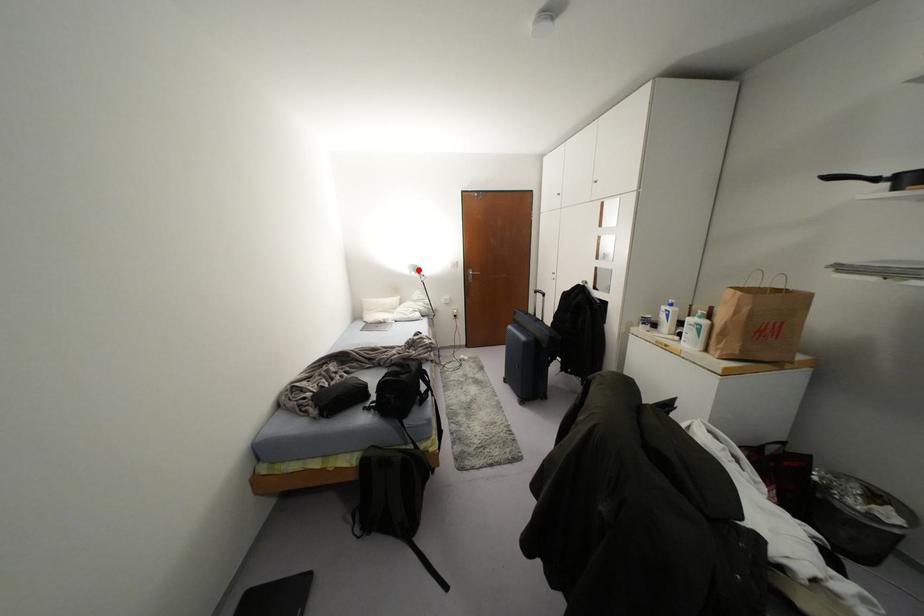
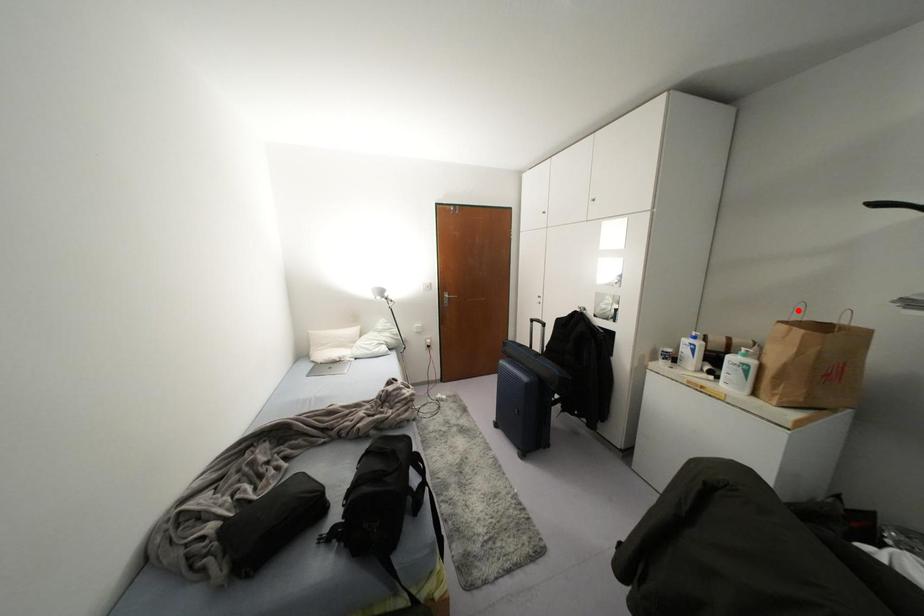
I am providing you with two images of the same scene from different viewpoints. A red point is marked on the first image and another point is marked on the second image. Are the points marked in image1 and image2 representing the same 3D position?

No